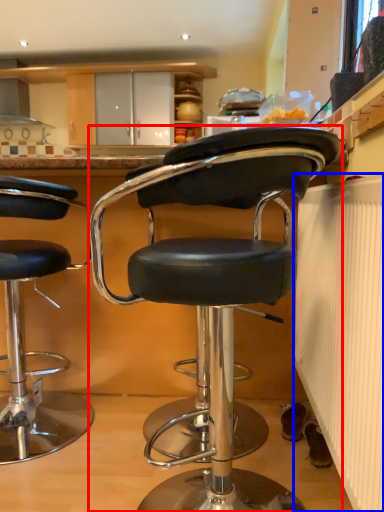
Question: Among these objects, which one is nearest to the camera, chair (highlighted by a red box) or radiator (highlighted by a blue box)?

Choices:
 (A) chair
 (B) radiator

Answer: (B)